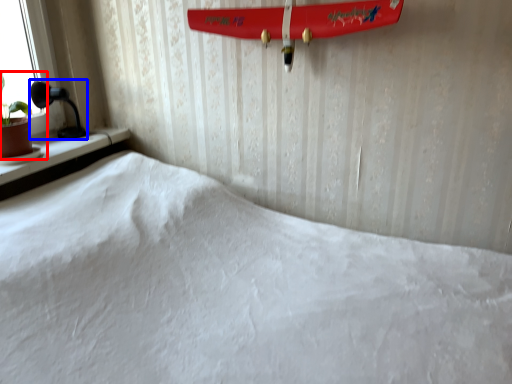
Question: Which object appears closest to the camera in this image, houseplant (highlighted by a red box) or table lamp (highlighted by a blue box)?

Choices:
 (A) houseplant
 (B) table lamp

Answer: (A)